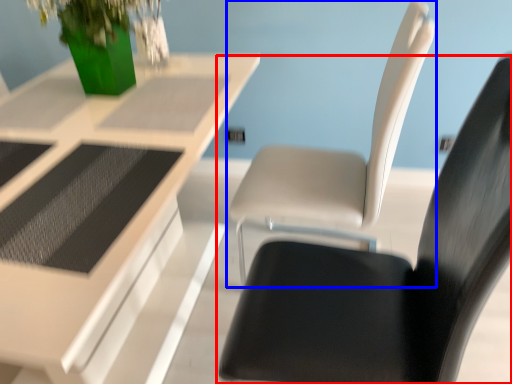
Question: Which point is further to the camera, chair (highlighted by a red box) or chair (highlighted by a blue box)?

Choices:
 (A) chair
 (B) chair

Answer: (B)